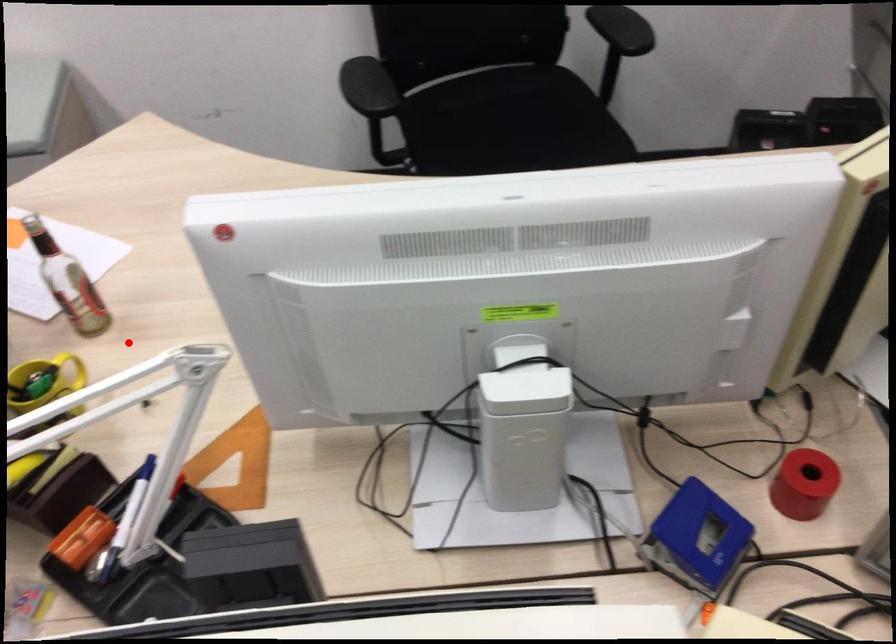
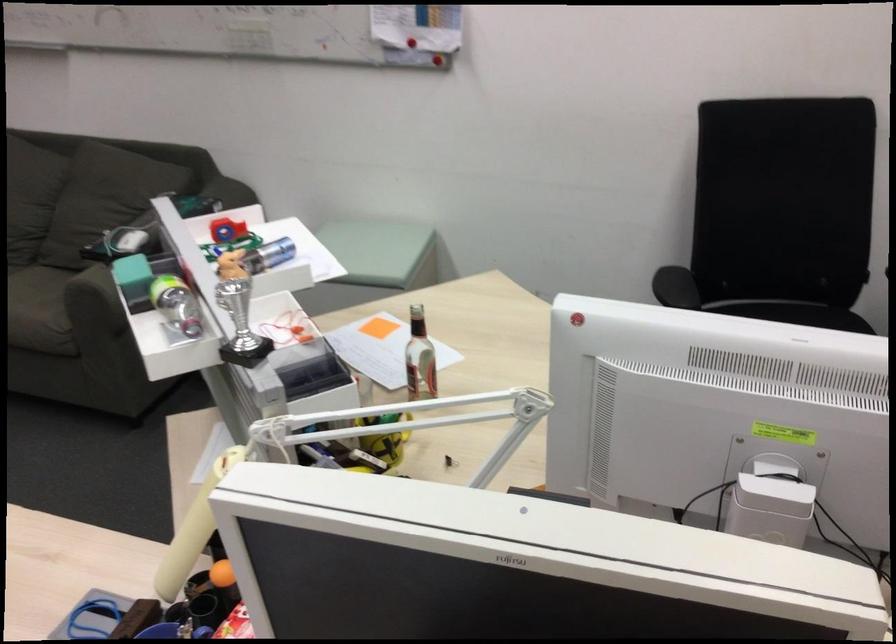
Question: I am providing you with two images of the same scene from different viewpoints. Given a red point in image1, look at the same physical point in image2. Is it:

Choices:
 (A) Closer to the viewpoint
 (B) Farther from the viewpoint

Answer: (B)